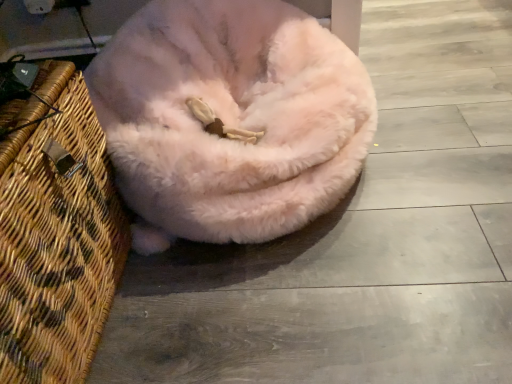
Question: Considering the relative positions of pink fluffy dog bed at center and woven wood basket at left in the image provided, is pink fluffy dog bed at center to the left or to the right of woven wood basket at left?

Choices:
 (A) left
 (B) right

Answer: (B)

Question: Does point (224, 112) appear closer or farther from the camera than point (65, 190)?

Choices:
 (A) closer
 (B) farther

Answer: (B)

Question: Is pink fluffy dog bed at center inside or outside of woven wood basket at left?

Choices:
 (A) inside
 (B) outside

Answer: (B)

Question: In terms of width, does woven wood basket at left look wider or thinner when compared to pink fluffy dog bed at center?

Choices:
 (A) wide
 (B) thin

Answer: (B)

Question: Looking at the image, does woven wood basket at left seem bigger or smaller compared to pink fluffy dog bed at center?

Choices:
 (A) big
 (B) small

Answer: (B)

Question: From the image's perspective, is woven wood basket at left located above or below pink fluffy dog bed at center?

Choices:
 (A) below
 (B) above

Answer: (A)

Question: Is woven wood basket at left taller or shorter than pink fluffy dog bed at center?

Choices:
 (A) short
 (B) tall

Answer: (B)